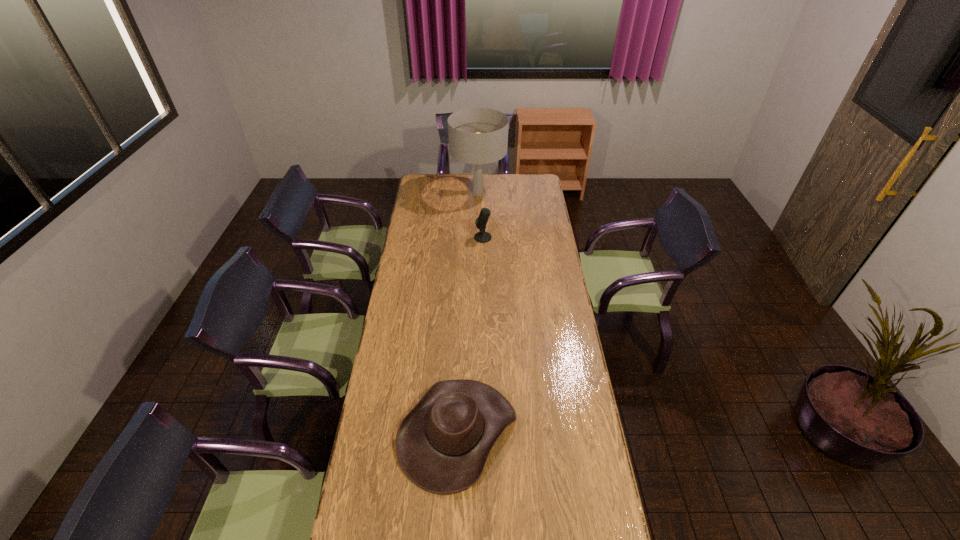
Identify the location of vacant region that satisfies the following two spatial constraints: 1. on the front-facing side of the microphone; 2. on the left side of the farthest object. (478, 238).

In order to click on free space that satisfies the following two spatial constraints: 1. on the front-facing side of the microphone; 2. on the left side of the farthest object in this screenshot , I will do (478, 238).